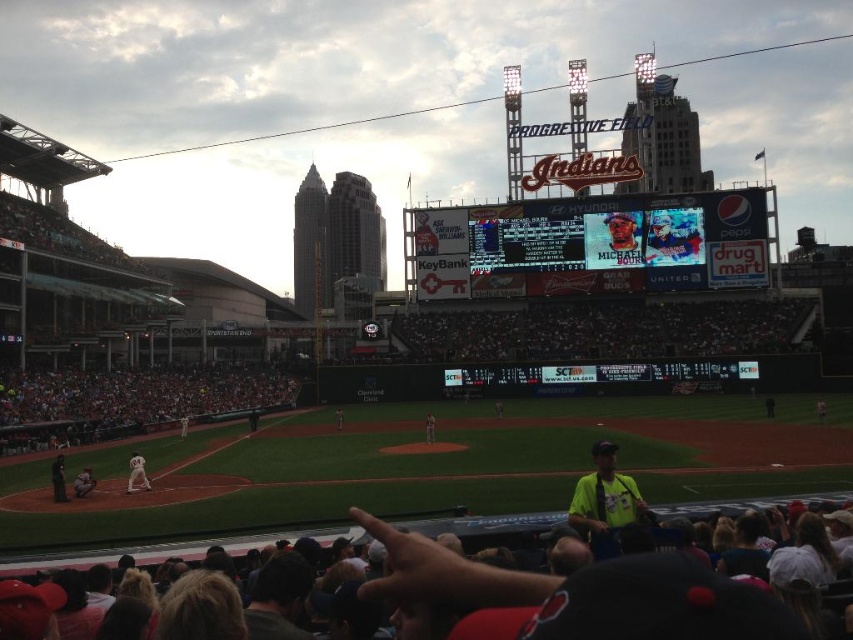
Question: Which point is closer to the camera?

Choices:
 (A) white uniform at center
 (B) matte gray uniform at lower left

Answer: (B)

Question: From the image, what is the correct spatial relationship of matte digital display at center in relation to dark hair at lower center?

Choices:
 (A) left
 (B) right

Answer: (B)

Question: Does dark hair at lower center have a smaller size compared to white uniformed player at center?

Choices:
 (A) no
 (B) yes

Answer: (A)

Question: Which of the following is the farthest from the observer?

Choices:
 (A) (590, 243)
 (B) (187, 426)
 (C) (338, 416)

Answer: (A)

Question: In this image, where is matte digital display at center located relative to matte gray uniform at lower left?

Choices:
 (A) below
 (B) above

Answer: (B)

Question: Considering the real-world distances, which object is farthest from the green jersey at lower left?

Choices:
 (A) matte gray uniform at lower left
 (B) yellow-green shirt at lower right
 (C) matte digital display at center
 (D) white uniformed player at center

Answer: (C)